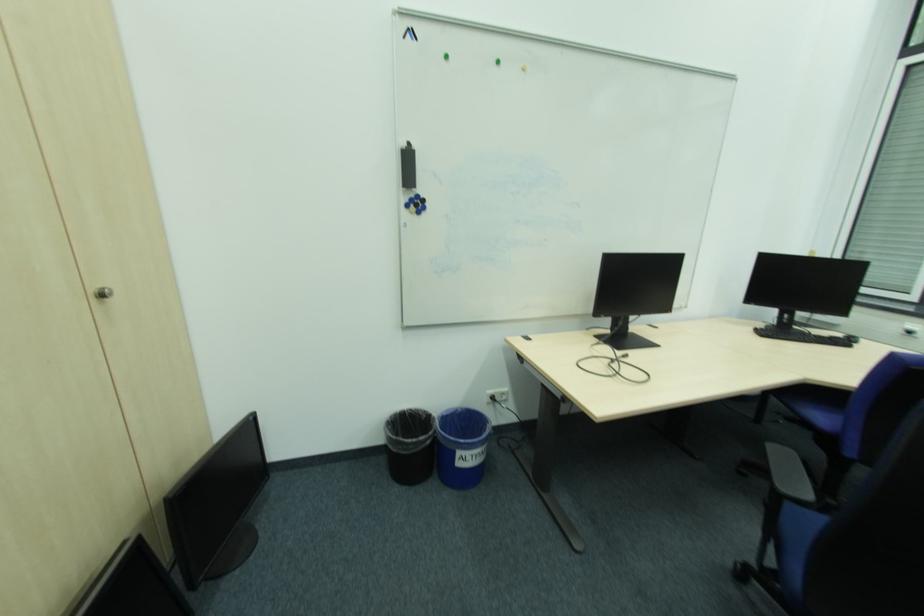
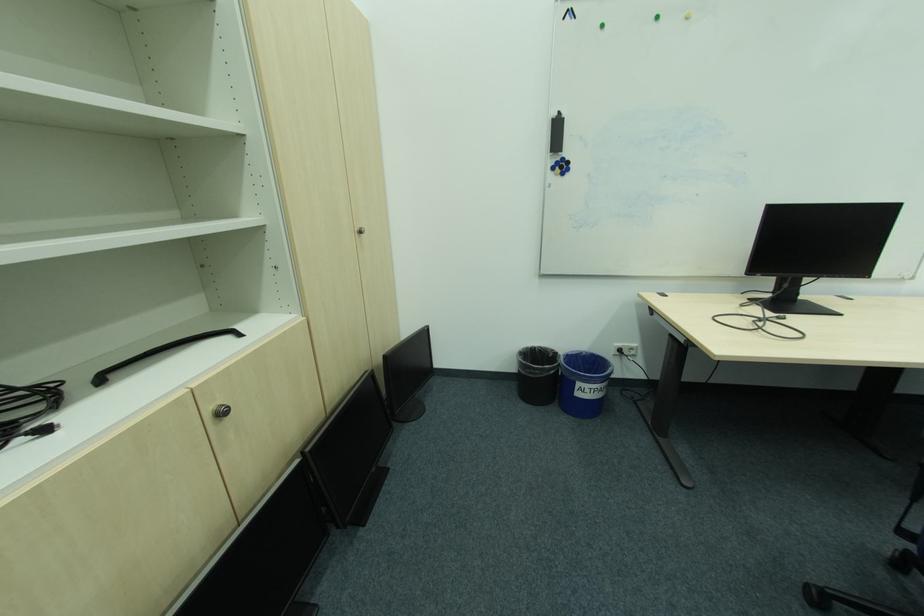
Find the pixel in the second image that matches (x=419, y=201) in the first image.

(565, 163)